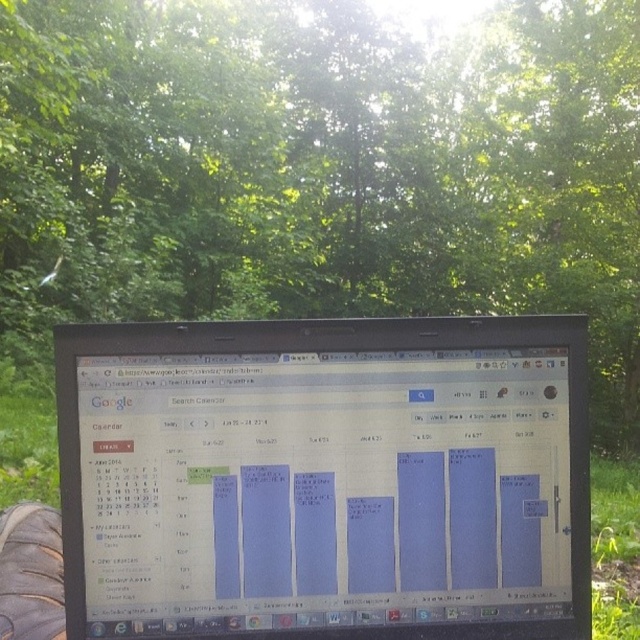
You are standing in a forest and see both the green leafy tree at center and the matte plastic laptop at center. Which object is positioned to the right of the other?

The green leafy tree at center is positioned to the right of the matte plastic laptop at center.

You are a photographer wanting to capture the matte plastic laptop at center and the green leafy tree at center in a single shot. Since you want the tree to be in focus, which object should you adjust your camera focus on?

Since the green leafy tree at center is further to the viewer than the matte plastic laptop at center, you should focus on the green leafy tree at center to ensure it is in focus.

You are standing in a forest and see the green leafy tree at center. If you want to take a photo of it with your smartphone camera, which has a maximum focus range of 5 meters, will you need to move closer to the tree?

The green leafy tree at center is 7.80 meters away from you. Since your smartphone camera can only focus up to 5 meters, you need to move closer to the tree to take a clear photo.